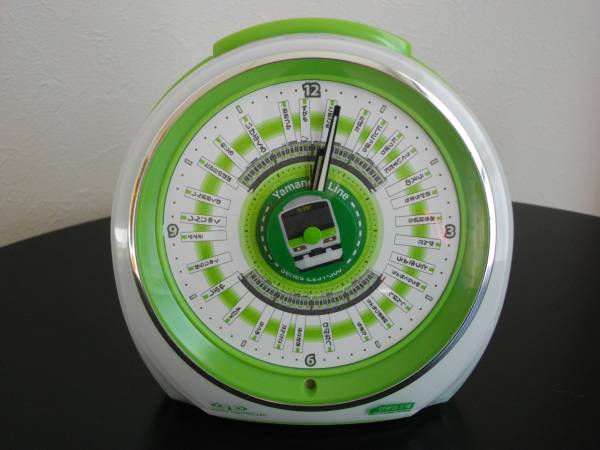
I want to click on gray background color, so click(x=85, y=49), click(x=539, y=96).